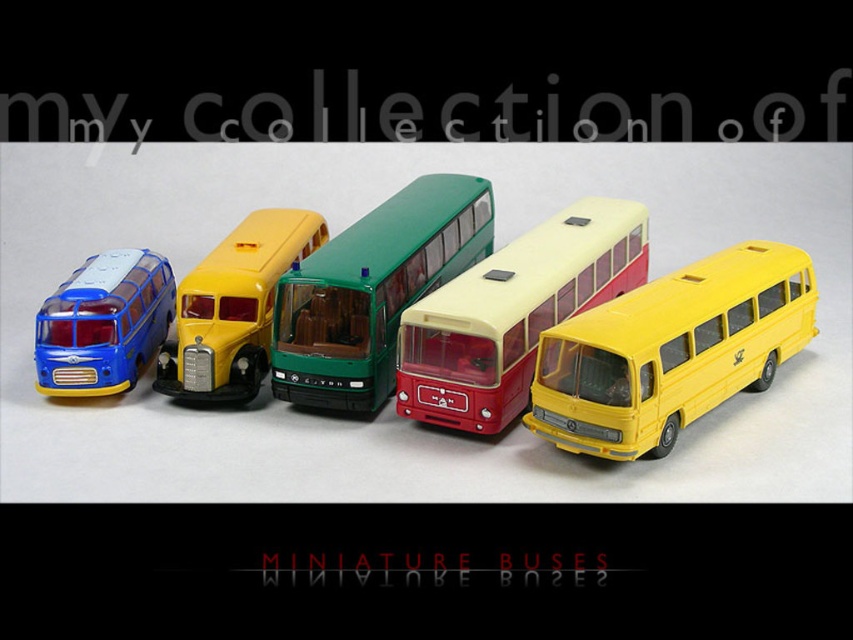
Question: Among these points, which one is nearest to the camera?

Choices:
 (A) (657, 403)
 (B) (102, 380)
 (C) (283, 300)

Answer: (A)

Question: Considering the relative positions of yellow matte bus at right and matte blue bus at left in the image provided, where is yellow matte bus at right located with respect to matte blue bus at left?

Choices:
 (A) right
 (B) left

Answer: (A)

Question: Does yellow matte bus at right appear under green matte/deep plastic bus at center?

Choices:
 (A) no
 (B) yes

Answer: (B)

Question: Which object appears farthest from the camera in this image?

Choices:
 (A) matte blue bus at left
 (B) blue matte bus at left
 (C) matte green double-decker bus at center

Answer: (A)

Question: Which point is farther from the camera taking this photo?

Choices:
 (A) (140, 372)
 (B) (228, 234)
 (C) (799, 284)

Answer: (B)

Question: Does blue matte bus at left appear over yellow matte bus at right?

Choices:
 (A) no
 (B) yes

Answer: (B)